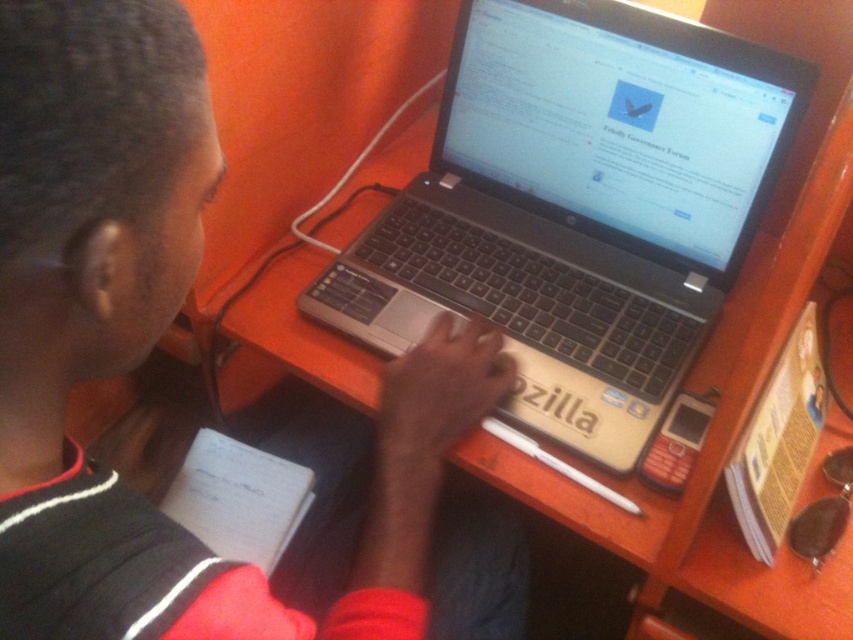
Question: Which of the following is the closest to the observer?

Choices:
 (A) (744, 88)
 (B) (62, 573)

Answer: (B)

Question: Which point appears farthest from the camera in this image?

Choices:
 (A) (428, 182)
 (B) (196, 244)

Answer: (A)

Question: Is black matte laptop at center smaller than black plastic laptop at center?

Choices:
 (A) no
 (B) yes

Answer: (A)

Question: Can you confirm if black matte laptop at center is bigger than black plastic laptop at center?

Choices:
 (A) yes
 (B) no

Answer: (A)

Question: Where is black matte laptop at center located in relation to black plastic laptop at center in the image?

Choices:
 (A) left
 (B) right

Answer: (A)